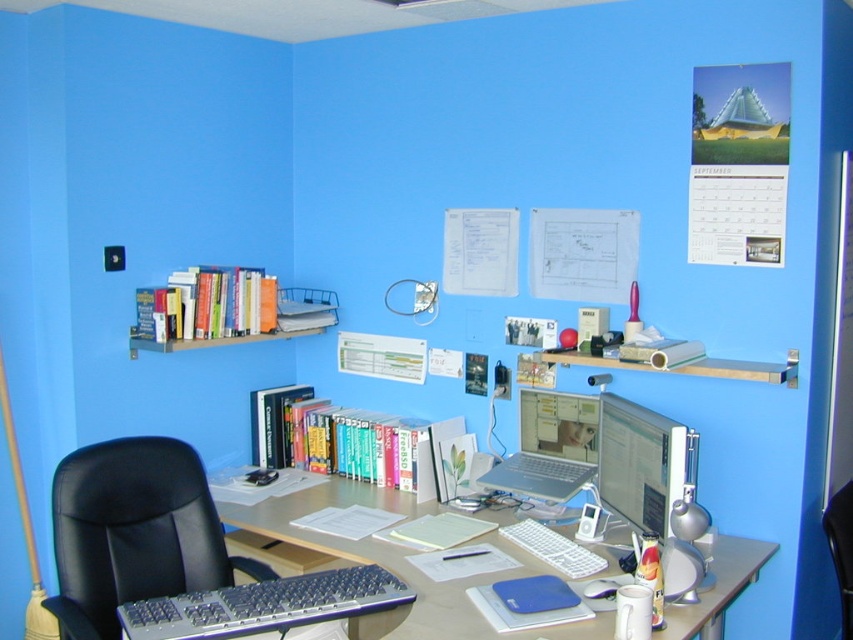
In the scene shown: You are a delivery person who needs to place a small package on the desk between the silver metallic keyboard at lower center and the matte silver monitor at center. The package is 10 inches long. Can you fit it horizontally between them without moving any items?

The distance between the silver metallic keyboard at lower center and the matte silver monitor at center is 33.80 inches. Since the package is only 10 inches long, it can easily be placed horizontally between them without needing to move any items.

You are setting up a new desk layout and want to place a decorative plant between the silver metallic keyboard at lower center and the matte silver monitor at center. Considering their sizes, which object should the plant be closer to?

The plant should be closer to the matte silver monitor at center because the silver metallic keyboard at lower center is smaller in size compared to the matte silver monitor at center.